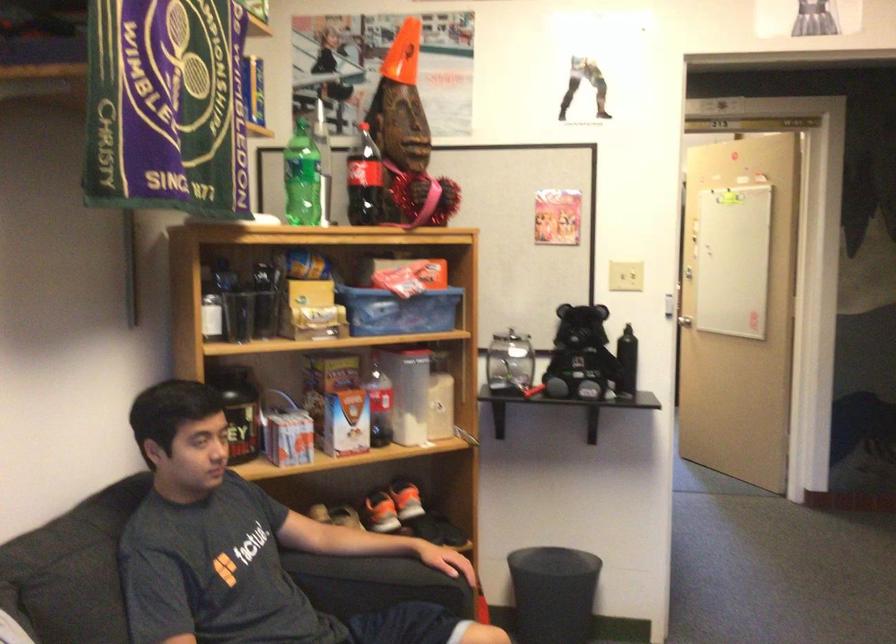
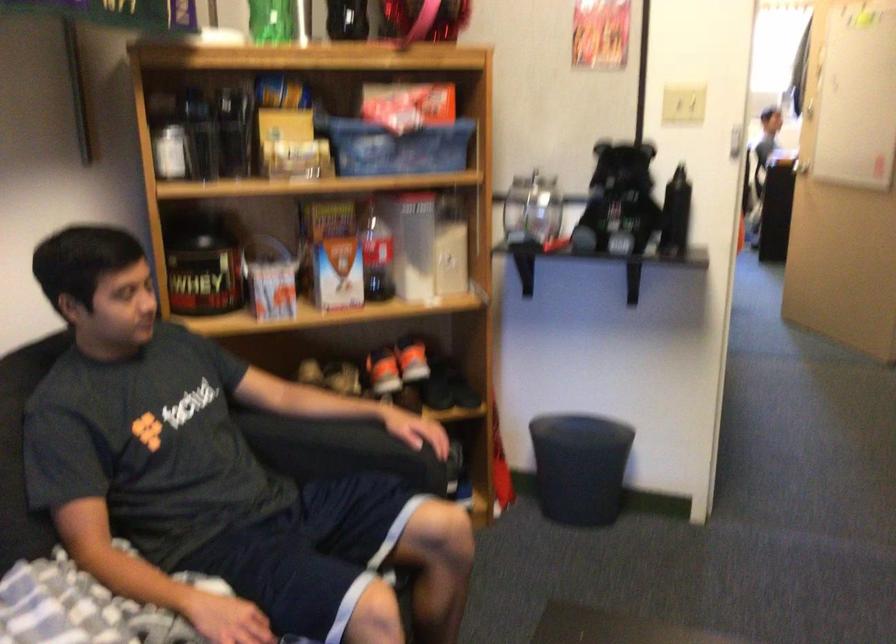
Where in the second image is the point corresponding to point (632, 368) from the first image?

(675, 214)